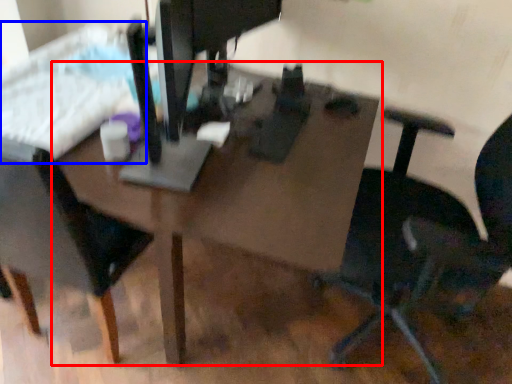
Question: Which object appears closest to the camera in this image, table (highlighted by a red box) or bed (highlighted by a blue box)?

Choices:
 (A) table
 (B) bed

Answer: (A)